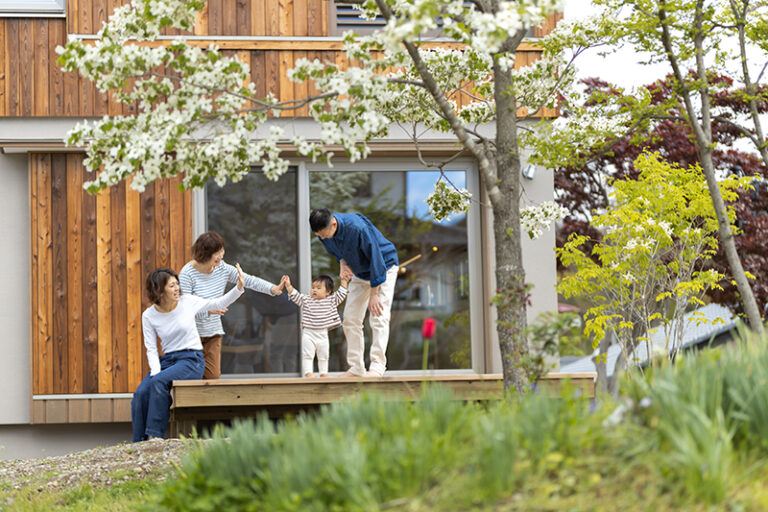
Find the location of a particular element. door is located at coordinates (267, 240).